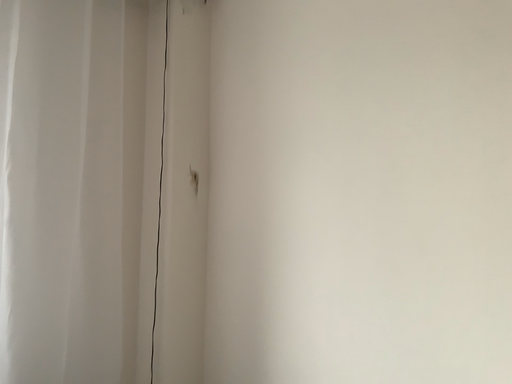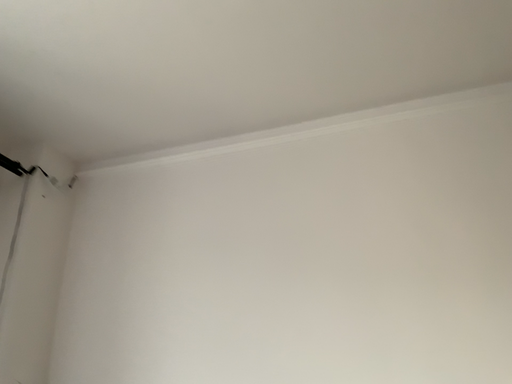
Question: Which way did the camera rotate in the video?

Choices:
 (A) rotated downward
 (B) rotated upward

Answer: (B)